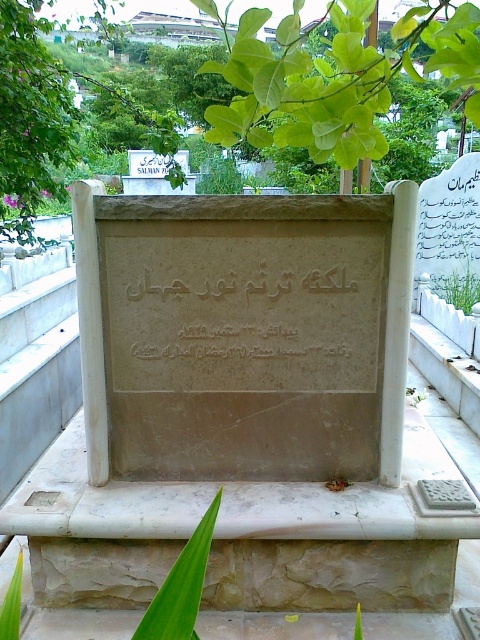
Does matte stone inscription at center appear under green leafy plant at lower left?

Actually, matte stone inscription at center is above green leafy plant at lower left.

Identify the location of matte stone inscription at center. The height and width of the screenshot is (640, 480). (240, 310).

Is green leafy plant at upper center wider than green leafy plant at lower left?

Correct, the width of green leafy plant at upper center exceeds that of green leafy plant at lower left.

From the picture: Between green leafy plant at upper center and green leafy plant at lower left, which one has more height?

green leafy plant at upper center

Who is more distant from viewer, (466, 273) or (15, 595)?

Positioned behind is point (466, 273).

Find the location of a particular element. The width and height of the screenshot is (480, 640). green leafy plant at upper center is located at coordinates (458, 282).

Does green leafy tree at upper center have a larger size compared to matte stone inscription at center?

Yes, green leafy tree at upper center is bigger than matte stone inscription at center.

Is green leafy tree at upper center above matte stone inscription at center?

Yes.

Locate an element on the screen. green leafy tree at upper center is located at coordinates (335, 77).